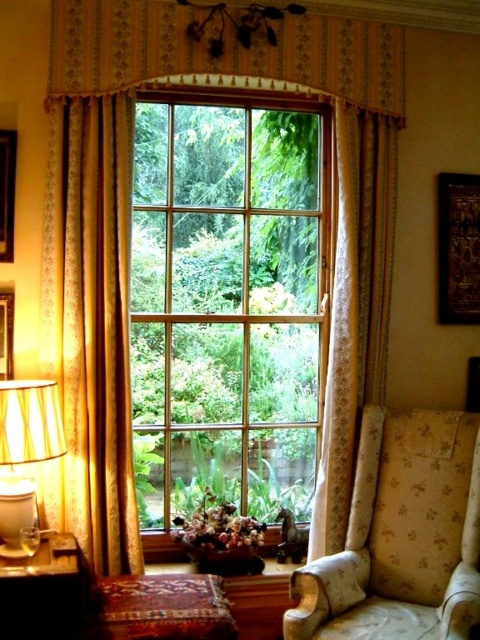
You are arranging a small potted plant in this room and want to place it where it can receive sunlight from the window. Considering the gold textured curtain at center and the floral fabric armchair at lower right, which object should the plant be placed closer to for optimal sunlight exposure?

The gold textured curtain at center is larger than the floral fabric armchair at lower right, so placing the plant closer to the floral fabric armchair at lower right would allow it to receive more sunlight since the smaller object casts a smaller shadow.

You are sitting in the floral fabric armchair at lower right and want to reach the gold textured curtain at center to adjust it. Which direction should you move to get closer to the curtain?

The gold textured curtain at center is to the left of the floral fabric armchair at lower right, so you should move to your left to get closer to the curtain.

You are arranging decorations on a shelf and have both the wooden picture frame at left and the matte black picture frame at left. If you want to place them side by side without overlapping, which frame should you place on the left to ensure they both fit?

The wooden picture frame at left might be wider than the matte black picture frame at left, so placing the wider wooden picture frame at left on the left side would allow both frames to fit side by side without overlapping.